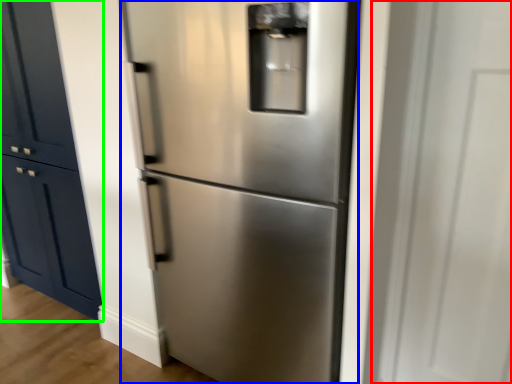
Question: Based on their relative distances, which object is farther from glass door (highlighted by a red box)? Choose from refrigerator (highlighted by a blue box) and door (highlighted by a green box).

Choices:
 (A) refrigerator
 (B) door

Answer: (B)